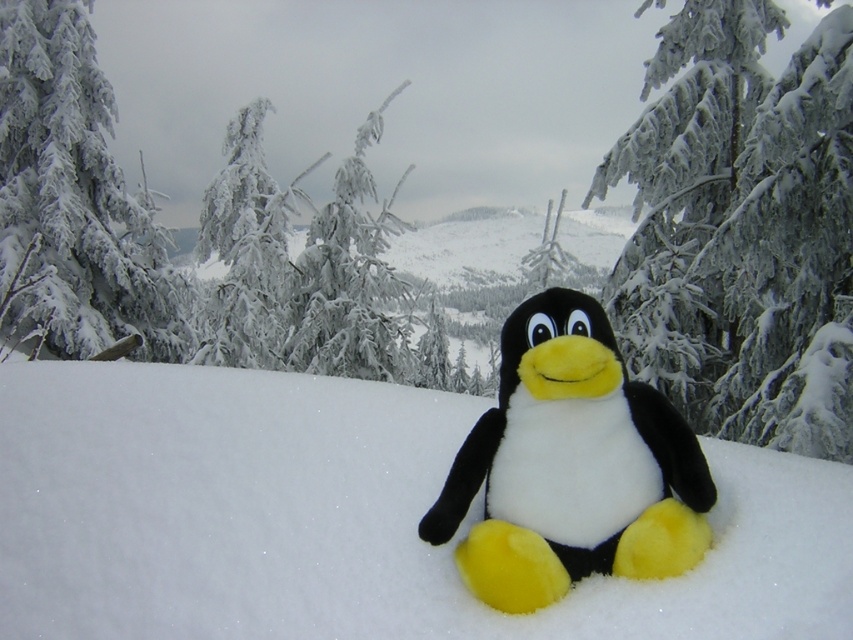
Which of these two, white fluffy snow at center or white frosty tree at upper center, stands shorter?

With less height is white fluffy snow at center.

Who is lower down, white fluffy snow at center or white frosty tree at upper center?

white fluffy snow at center

Where is `white fluffy snow at center`? white fluffy snow at center is located at coordinates (341, 518).

Can you confirm if white fluffy snow at center is positioned to the right of soft plush penguin at center?

In fact, white fluffy snow at center is to the left of soft plush penguin at center.

Find the location of a particular element. white fluffy snow at center is located at coordinates (341, 518).

Locate an element on the screen. This screenshot has width=853, height=640. white fluffy snow at center is located at coordinates (341, 518).

Is the position of white snow-covered tree at upper left more distant than that of frosted snow-covered tree at center?

No, white snow-covered tree at upper left is closer to the viewer.

Is white snow-covered tree at upper left positioned before frosted snow-covered tree at center?

Yes, it is.

Does point (111, 112) come farther from viewer compared to point (338, 182)?

No, it is not.

You are a GUI agent. You are given a task and a screenshot of the screen. Output one action in this format:
    pyautogui.click(x=<x>, y=<y>)
    Task: Click on the white snow-covered tree at upper left
    The image size is (853, 640).
    Given the screenshot: What is the action you would take?
    pyautogui.click(x=74, y=196)